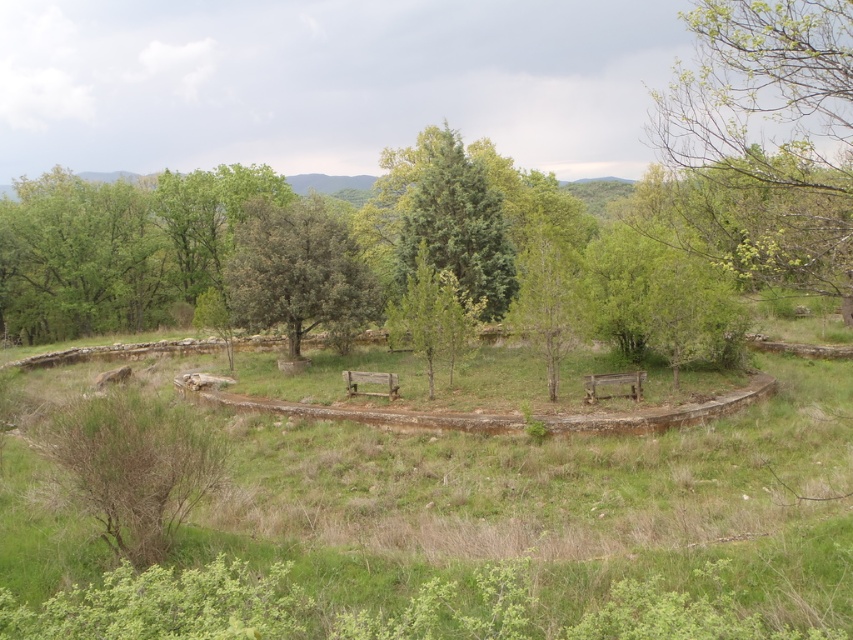
Is point (701, 164) positioned before point (302, 308)?

That is True.

Can you confirm if green leafy tree at upper right is positioned to the left of green leafy tree at center?

In fact, green leafy tree at upper right is to the right of green leafy tree at center.

Between point (837, 198) and point (325, 260), which one is positioned in front?

Point (837, 198)

Find the location of a particular element. green leafy tree at upper right is located at coordinates (770, 145).

Can you confirm if green leafy tree at center is thinner than green textured tree at center?

No, green leafy tree at center is not thinner than green textured tree at center.

Is point (254, 300) closer to viewer compared to point (410, 180)?

Yes, it is in front of point (410, 180).

Where is `green leafy tree at center`? green leafy tree at center is located at coordinates (297, 269).

Is green leafy tree at upper left to the right of green textured tree at center from the viewer's perspective?

In fact, green leafy tree at upper left is to the left of green textured tree at center.

Who is positioned more to the left, green leafy tree at upper left or green textured tree at center?

Positioned to the left is green leafy tree at upper left.

Where is `green leafy tree at upper left`? The width and height of the screenshot is (853, 640). green leafy tree at upper left is located at coordinates (79, 259).